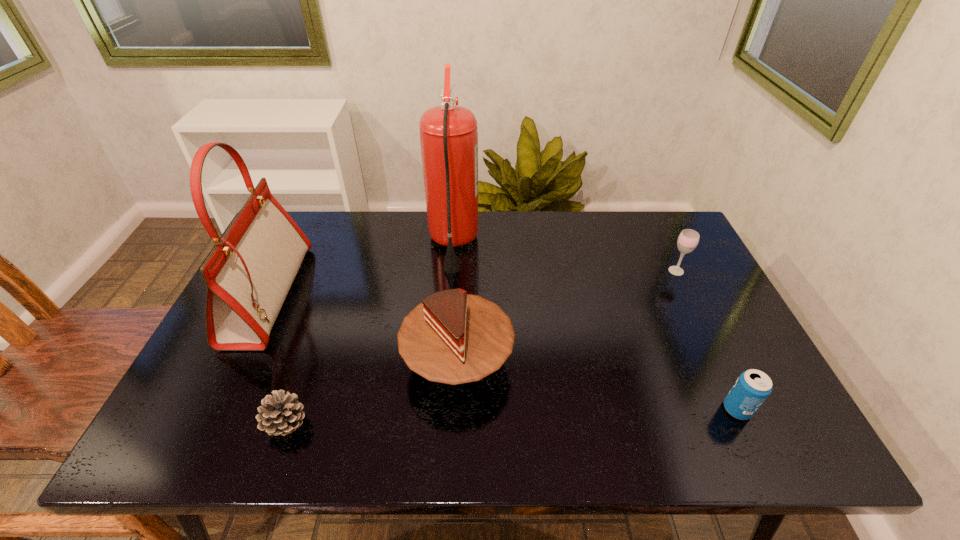
Identify the location of vacant space situated on the front of the wineglass. (728, 377).

Image resolution: width=960 pixels, height=540 pixels. I want to click on free space located 0.260m on the back of the fifth tallest object, so click(x=692, y=313).

The width and height of the screenshot is (960, 540). In order to click on free region located on the left of the shortest object in this screenshot , I will do `click(228, 424)`.

You are a GUI agent. You are given a task and a screenshot of the screen. Output one action in this format:
    pyautogui.click(x=<x>, y=<y>)
    Task: Click on the fire extinguisher that is at the far edge
    
    Given the screenshot: What is the action you would take?
    coord(448,133)

At what (x,y) coordinates should I click in order to perform the action: click on handbag present at the far edge. Please return your answer as a coordinate pair (x, y). The image size is (960, 540). Looking at the image, I should click on (248, 274).

Locate an element on the screen. This screenshot has width=960, height=540. soda can positioned at the near edge is located at coordinates (752, 388).

The image size is (960, 540). In order to click on pinecone located at the near edge in this screenshot , I will do `click(280, 415)`.

Image resolution: width=960 pixels, height=540 pixels. Find the location of `object at the left edge`. object at the left edge is located at coordinates (248, 274).

Locate an element on the screen. wineglass that is at the right edge is located at coordinates (688, 239).

Identify the location of soda can situated at the right edge. tap(752, 388).